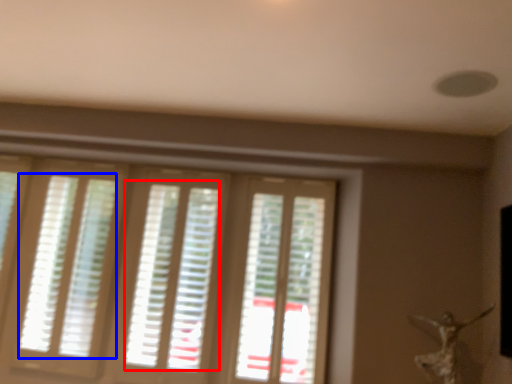
Question: Which point is further to the camera, blind (highlighted by a red box) or blind (highlighted by a blue box)?

Choices:
 (A) blind
 (B) blind

Answer: (B)